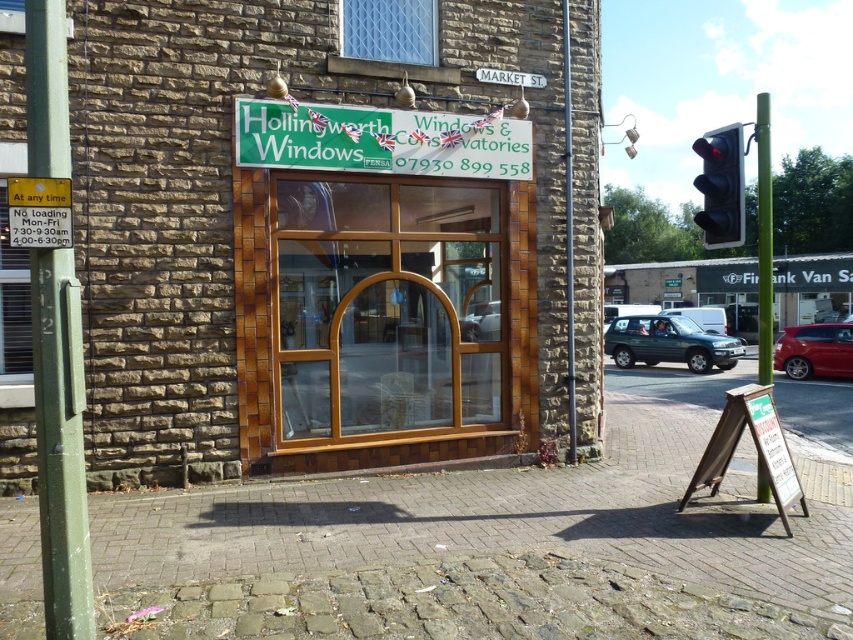
You are a delivery person trying to park a 1.2 meter wide delivery van between the green painted metal pole at left and the metallic pole at center. Can the van fit between them?

The green painted metal pole at left is wider than the metallic pole at center. However, the question is about the space between them, not their widths. Since the description only states the width comparison, there is insufficient information to determine the distance between the poles. Please check the actual space available.

You are a delivery driver who needs to park your truck near the Hollingworth Windows store on Market Street. The truck is 2 meters wide. There is a wooden window at center and a metallic traffic light at upper right. Can you park your truck between them without overlapping either object?

The wooden window at center is smaller than the metallic traffic light at upper right, but the exact distance between them isn not specified. Without knowing the space between the two objects, it is impossible to determine if the truck can fit. Please check the actual distance between the wooden window at center and the metallic traffic light at upper right before deciding to park.